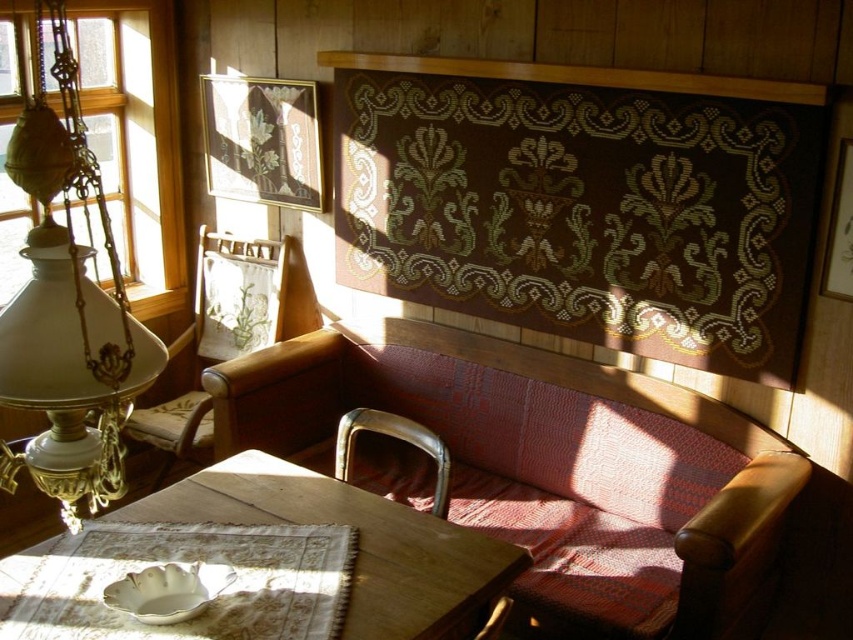
Does point (175, 492) come farther from viewer compared to point (338, 456)?

No, (175, 492) is closer to viewer.

Between wooden table at center and metallic gold armchair at lower center, which one has less height?

metallic gold armchair at lower center

Which is behind, point (376, 500) or point (361, 412)?

The point (361, 412) is behind.

I want to click on wooden table at center, so click(x=358, y=541).

Between wooden upholstered chair at center and metallic gold armchair at lower center, which one appears on the right side from the viewer's perspective?

From the viewer's perspective, metallic gold armchair at lower center appears more on the right side.

Can you confirm if wooden upholstered chair at center is smaller than metallic gold armchair at lower center?

Incorrect, wooden upholstered chair at center is not smaller in size than metallic gold armchair at lower center.

Between point (303, 280) and point (395, 422), which one is positioned in front?

Point (395, 422)

Where is `wooden upholstered chair at center`? wooden upholstered chair at center is located at coordinates (242, 296).

Who is positioned more to the right, matte glass lampshade at left or wooden table at center?

Positioned to the right is wooden table at center.

The height and width of the screenshot is (640, 853). What do you see at coordinates (136, 140) in the screenshot?
I see `matte glass lampshade at left` at bounding box center [136, 140].

Where is `matte glass lampshade at left`? The height and width of the screenshot is (640, 853). matte glass lampshade at left is located at coordinates (136, 140).